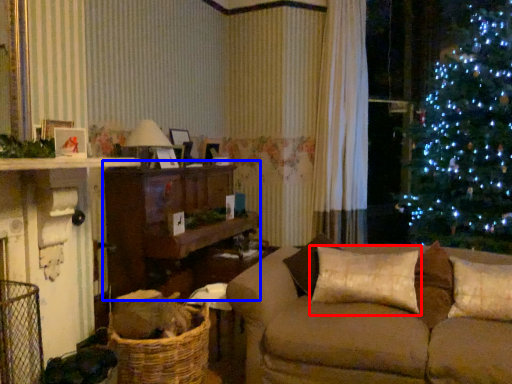
Question: Among these objects, which one is farthest to the camera, pillow (highlighted by a red box) or entertainment center (highlighted by a blue box)?

Choices:
 (A) pillow
 (B) entertainment center

Answer: (B)